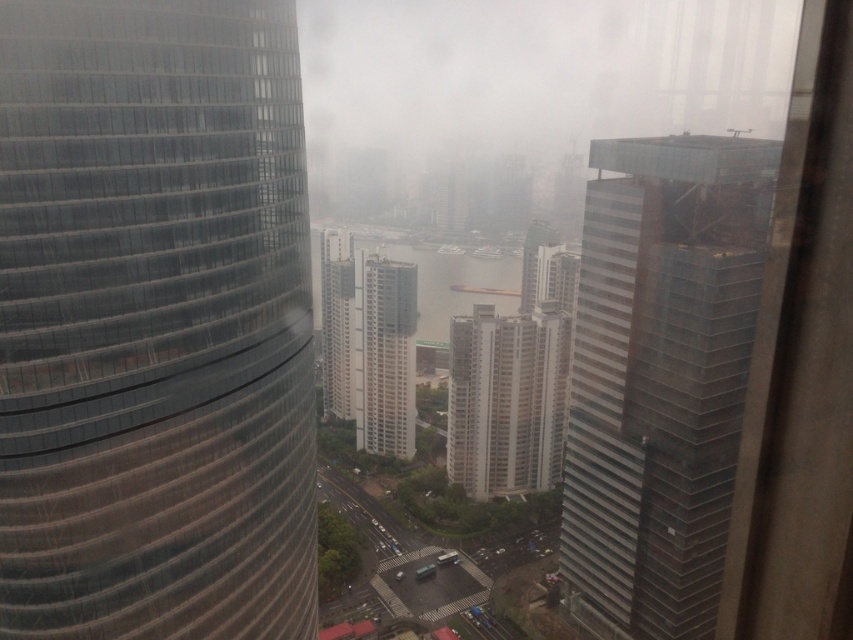
Which of these two, transparent glass skyscraper at right or white glass building at center, stands shorter?

white glass building at center is shorter.

The height and width of the screenshot is (640, 853). Find the location of `transparent glass skyscraper at right`. transparent glass skyscraper at right is located at coordinates (660, 372).

Looking at this image, can you confirm if transparent glass skyscraper at right is positioned to the left of white textured building at center?

No, transparent glass skyscraper at right is not to the left of white textured building at center.

Can you confirm if transparent glass skyscraper at right is thinner than white textured building at center?

No.

What do you see at coordinates (660, 372) in the screenshot? The width and height of the screenshot is (853, 640). I see `transparent glass skyscraper at right` at bounding box center [660, 372].

This screenshot has height=640, width=853. I want to click on transparent glass skyscraper at right, so click(x=660, y=372).

Who is shorter, transparent glass tower at left or white textured building at center?

Standing shorter between the two is white textured building at center.

Does transparent glass tower at left have a smaller size compared to white textured building at center?

No, transparent glass tower at left is not smaller than white textured building at center.

The width and height of the screenshot is (853, 640). What are the coordinates of `transparent glass tower at left` in the screenshot? It's located at (154, 323).